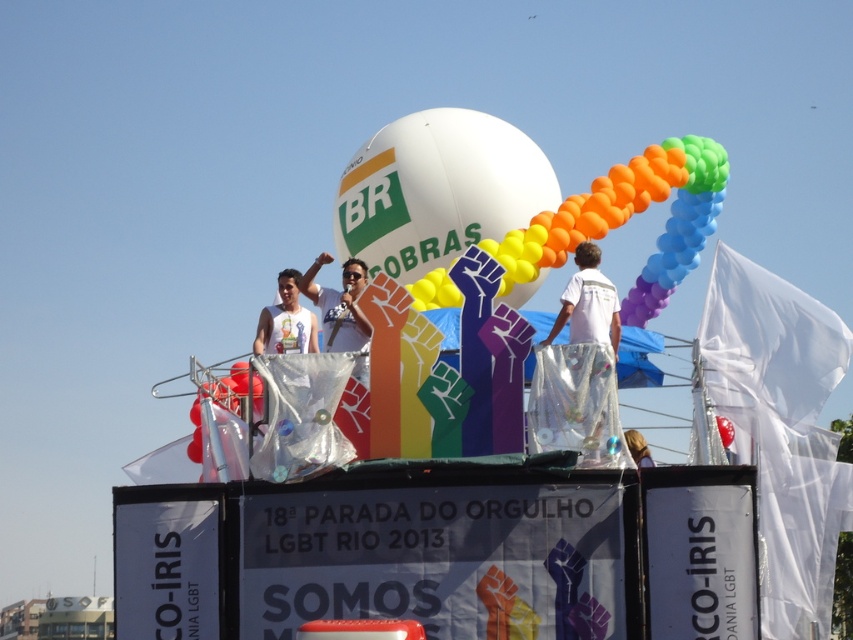
You are a photographer at the 18th Pride Parade in Rio de Janeiro. You want to take a photo of the white shiny pants at center without any rainbow balloons at center blocking the view. Is this possible?

The white shiny pants at center is behind the rainbow balloons at center, so taking a photo of the white shiny pants at center without any rainbow balloons at center blocking the view is not possible.

You are a photographer at the 18th Pride Parade in Rio de Janeiro. You want to capture a photo where the rainbow balloons at center and the white shiny pants at center are both visible. Based on their heights, which object should be placed closer to the camera to ensure both are in frame?

Since the rainbow balloons at center are taller than the white shiny pants at center, to ensure both are in frame, the photographer should position the camera closer to the rainbow balloons at center. This way, the taller balloons will occupy more of the foreground, allowing the shorter white shiny pants at center to still be visible in the background without being obscured.

You are a photographer at the Pride Parade and want to capture a clear photo of the white shiny pants at center and the white matte tank top at center. Which one will appear closer to the camera in the photo?

The white shiny pants at center will appear closer to the camera because it is in front of the white matte tank top at center.